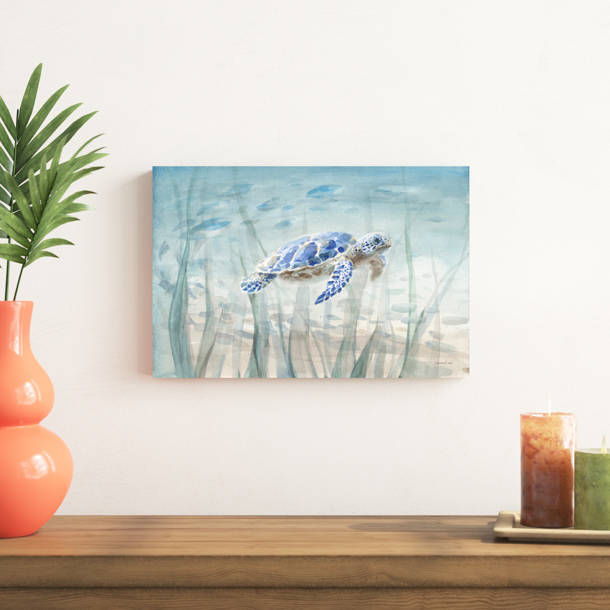
The width and height of the screenshot is (610, 610). I want to click on candle, so click(534, 509), click(582, 503).